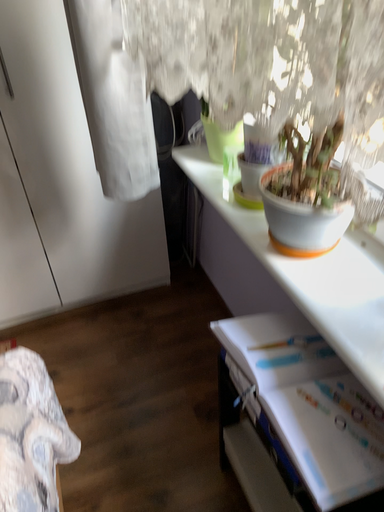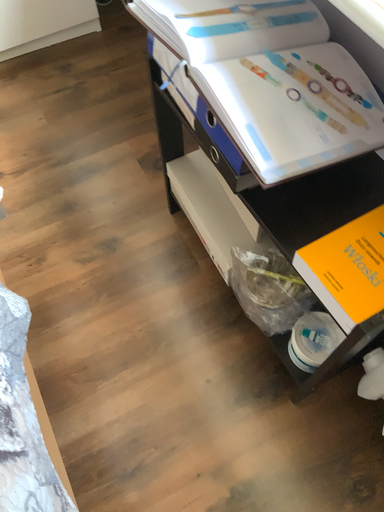
Question: Which way did the camera rotate in the video?

Choices:
 (A) rotated downward
 (B) rotated upward

Answer: (A)